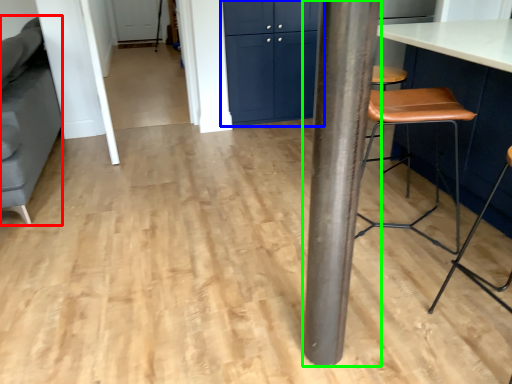
Question: Which object is the closest to the swivel chair (highlighted by a red box)? Choose among these: cabinetry (highlighted by a blue box) or pillar (highlighted by a green box).

Choices:
 (A) cabinetry
 (B) pillar

Answer: (A)